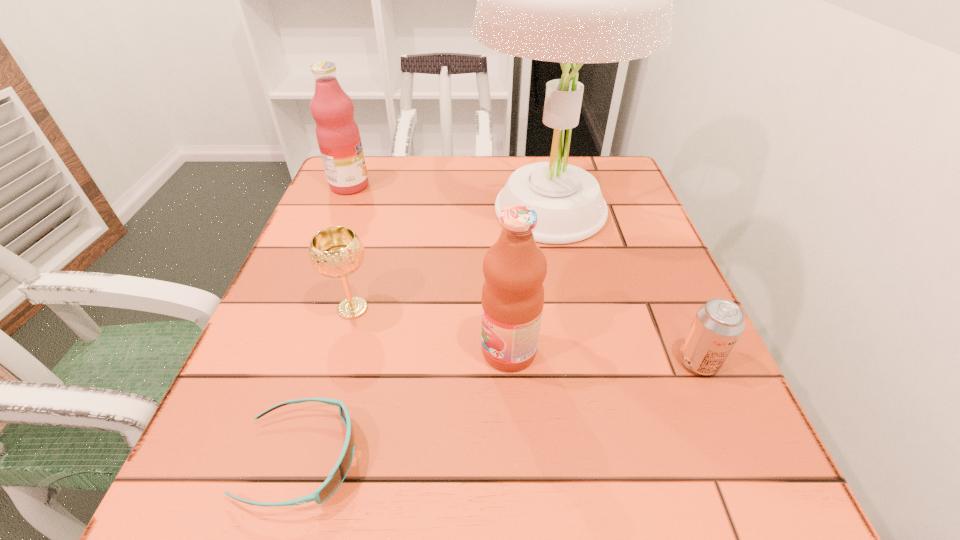
At what (x,y) coordinates should I click in order to perform the action: click on vacant space situated 0.090m on the front label of the right fruit juice. Please return your answer as a coordinate pair (x, y). Image resolution: width=960 pixels, height=540 pixels. Looking at the image, I should click on (427, 350).

Find the location of a particular element. vacant space located 0.190m on the front label of the right fruit juice is located at coordinates (368, 350).

Identify the location of vacant area situated on the front label of the right fruit juice. (254, 350).

Where is `vacant space positioned on the back of the third farthest object`? The height and width of the screenshot is (540, 960). vacant space positioned on the back of the third farthest object is located at coordinates (370, 248).

Image resolution: width=960 pixels, height=540 pixels. I want to click on vacant space situated on the left of the beer can, so click(440, 361).

Locate an element on the screen. This screenshot has width=960, height=540. blank space located on the front-facing side of the shortest object is located at coordinates (468, 458).

Image resolution: width=960 pixels, height=540 pixels. In order to click on lamp located in the far edge section of the desktop in this screenshot , I will do `click(571, 0)`.

Image resolution: width=960 pixels, height=540 pixels. I want to click on fruit juice located in the far edge section of the desktop, so click(337, 133).

Find the location of a particular element. object at the near edge is located at coordinates (337, 475).

In order to click on fruit juice located at the left edge in this screenshot , I will do `click(337, 133)`.